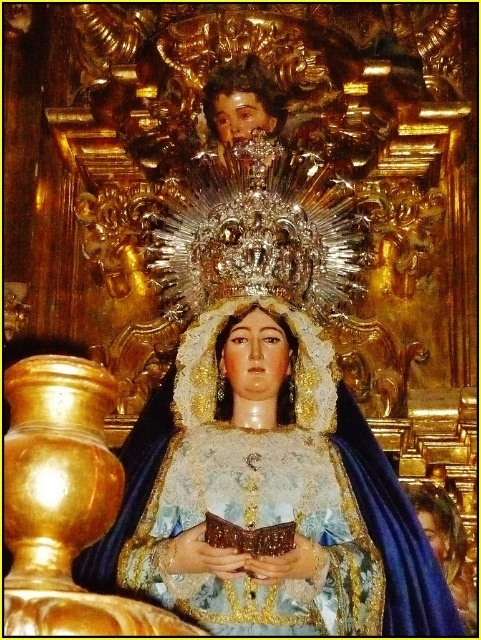
You are an art conservator examining the statue. You need to determine the spatial relationship between the matte blue fabric at center and the smooth golden hair at lower right. Which object is positioned higher on the statue?

The matte blue fabric at center is positioned higher than the smooth golden hair at lower right, as it is located above it.

You are an art restorer examining the statue. You need to clean the matte blue fabric at center and the smooth golden hair at lower right. Which part should you start with first based on their positions?

The matte blue fabric at center should be cleaned first because it is closer to the viewer than the smooth golden hair at lower right.